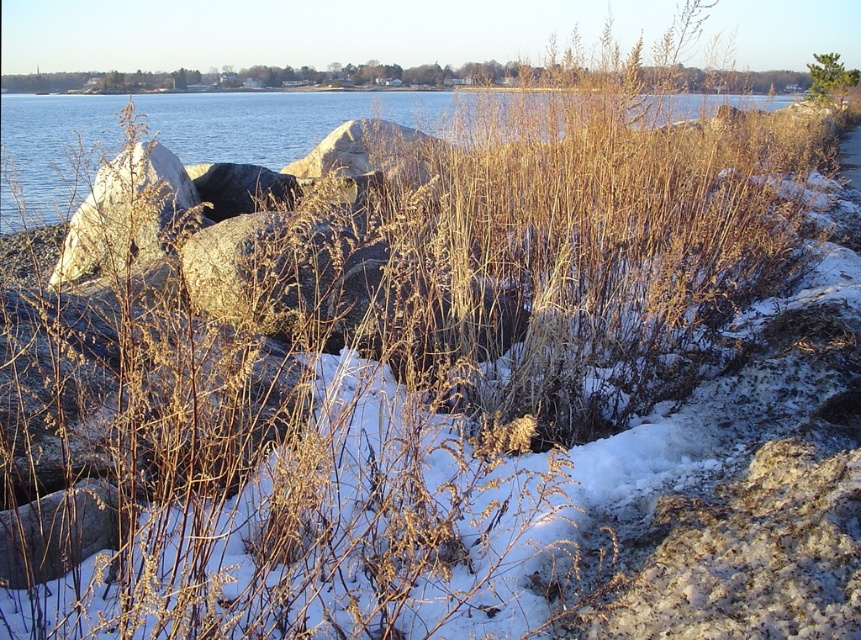
You are a painter setting up an easel to capture the winter scene. You want to ensure your painting emphasizes the blue water at upper center and green leafy tree at upper right. Based on their positions and sizes in the image, which object should you focus on first to ensure proper composition?

The blue water at upper center is wider than the green leafy tree at upper right, so you should focus on the blue water at upper center first to establish the broader background before detailing the smaller tree.

You are an artist planning to paint the winter landscape scene. You want to ensure the blue water at upper center and the green leafy tree at upper right are proportionally accurate. Which object should you paint first to maintain the correct size relationship between them?

You should paint the blue water at upper center first because it is larger in size than the green leafy tree at upper right, so starting with the larger area ensures proper scaling before detailing the smaller element.